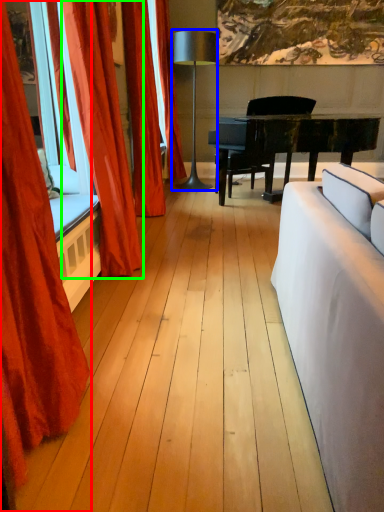
Question: Which object is the farthest from curtain (highlighted by a red box)? Choose among these: lamp (highlighted by a blue box) or curtain (highlighted by a green box).

Choices:
 (A) lamp
 (B) curtain

Answer: (A)